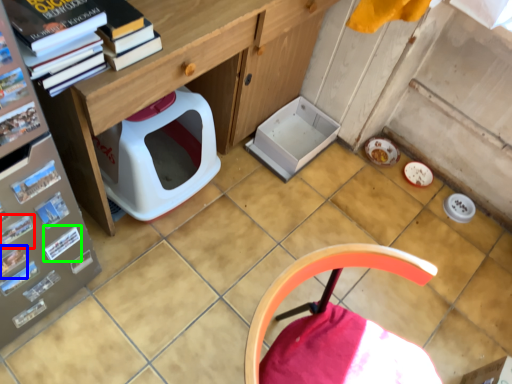
Question: Which object is the farthest from magazine (highlighted by a red box)? Choose among these: magazine (highlighted by a blue box) or paperback book (highlighted by a green box).

Choices:
 (A) magazine
 (B) paperback book

Answer: (B)